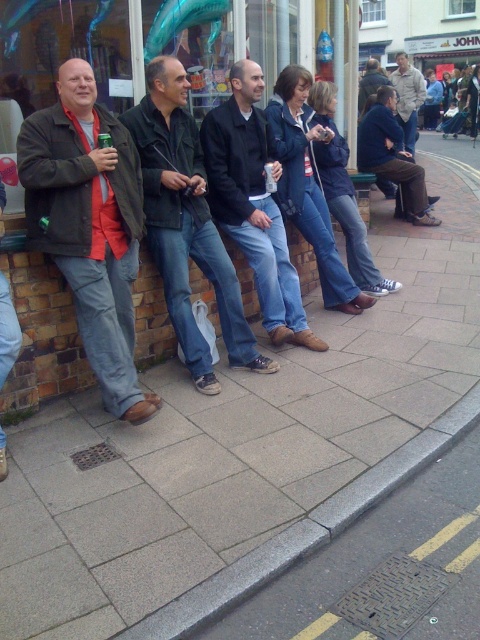
Question: Which object appears closest to the camera in this image?

Choices:
 (A) dark green jacket at center
 (B) dark brown leather shoes at center
 (C) light brown textured shirt at center
 (D) dark brown leather jacket at center

Answer: (A)

Question: Which point is closer to the camera?

Choices:
 (A) dark brown leather jacket at center
 (B) matte black jacket at left
 (C) dark brown leather shoes at center

Answer: (B)

Question: Does dark green jacket at center appear on the right side of light brown textured shirt at center?

Choices:
 (A) no
 (B) yes

Answer: (A)

Question: Which object is the closest to the matte black jacket at left?

Choices:
 (A) dark green jacket at center
 (B) light brown textured shirt at center

Answer: (A)

Question: Is matte black jacket at left smaller than light brown textured shirt at center?

Choices:
 (A) yes
 (B) no

Answer: (A)

Question: Is matte black jacket at left bigger than dark green jacket at center?

Choices:
 (A) yes
 (B) no

Answer: (B)